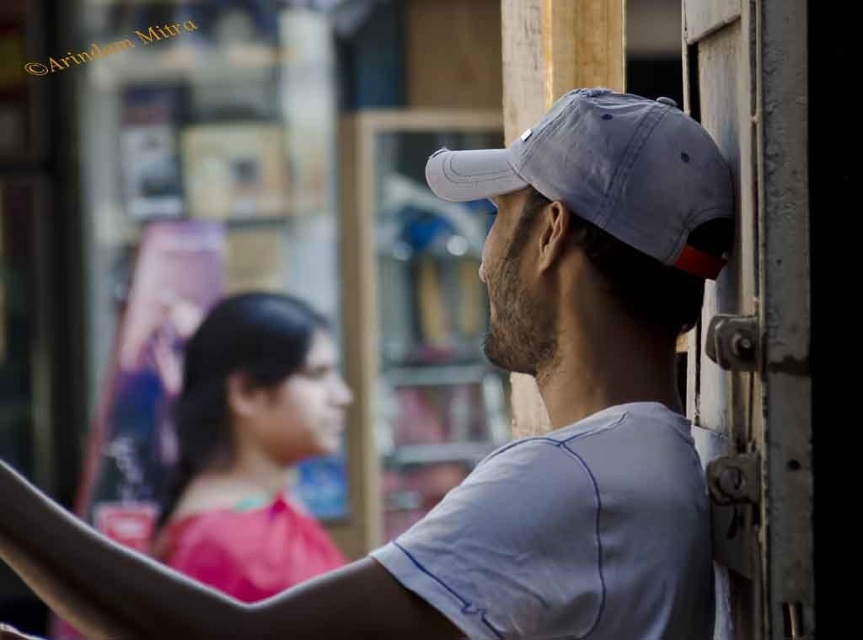
Which is above, gray fabric cap at upper right or gray cotton baseball cap at upper right?

gray cotton baseball cap at upper right is higher up.

Can you confirm if gray fabric cap at upper right is wider than gray cotton baseball cap at upper right?

Indeed, gray fabric cap at upper right has a greater width compared to gray cotton baseball cap at upper right.

This screenshot has width=863, height=640. In order to click on gray fabric cap at upper right in this screenshot , I will do [x=513, y=442].